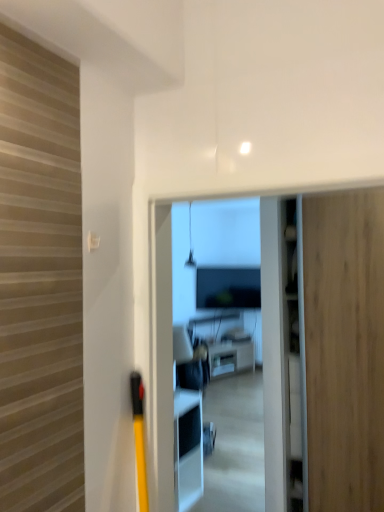
Question: Would you say white glossy coffee table at center is inside or outside wooden door at right?

Choices:
 (A) inside
 (B) outside

Answer: (B)

Question: From their relative heights in the image, would you say white glossy coffee table at center is taller or shorter than wooden door at right?

Choices:
 (A) short
 (B) tall

Answer: (A)

Question: From a real-world perspective, relative to wooden door at right, is white glossy coffee table at center vertically above or below?

Choices:
 (A) above
 (B) below

Answer: (B)

Question: Is wooden door at right taller or shorter than white glossy coffee table at center?

Choices:
 (A) short
 (B) tall

Answer: (B)

Question: From a real-world perspective, is wooden door at right above or below white glossy coffee table at center?

Choices:
 (A) below
 (B) above

Answer: (B)

Question: Is wooden door at right to the left or to the right of white glossy coffee table at center in the image?

Choices:
 (A) right
 (B) left

Answer: (A)

Question: In the image, is wooden door at right positioned in front of or behind white glossy coffee table at center?

Choices:
 (A) behind
 (B) front

Answer: (B)